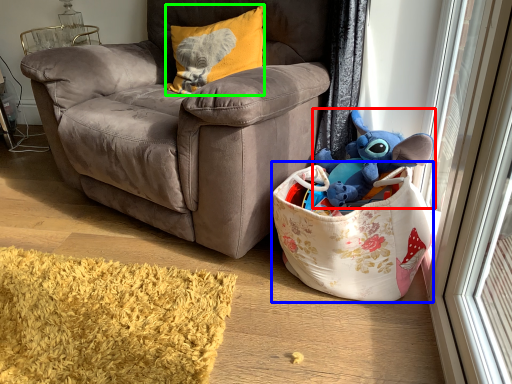
Question: Considering the real-world distances, which object is closest to toy (highlighted by a red box)? gift basket (highlighted by a blue box) or pillow (highlighted by a green box).

Choices:
 (A) gift basket
 (B) pillow

Answer: (A)